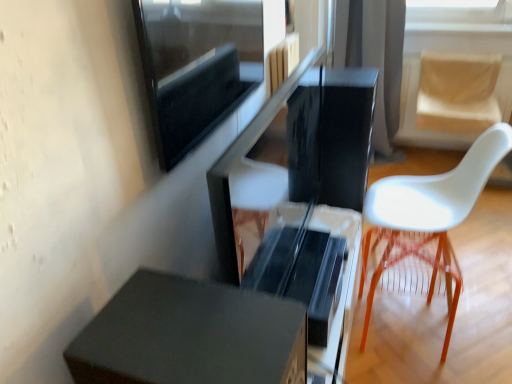
The height and width of the screenshot is (384, 512). I want to click on vacant space to the right of white plastic chair at right, so coord(486,266).